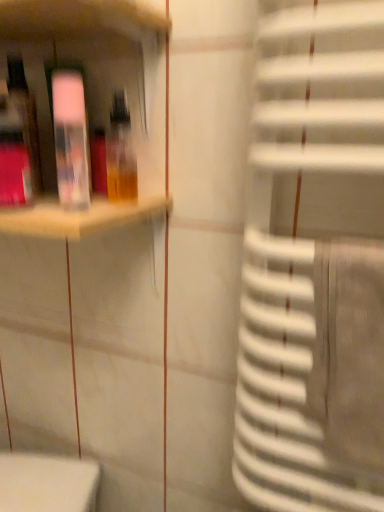
What is the approximate width of matte plastic shelf at upper left?

It is 9.54 inches.

Describe the element at coordinates (84, 58) in the screenshot. I see `matte plastic shelf at upper left` at that location.

Locate an element on the screen. The width and height of the screenshot is (384, 512). transparent plastic bottle at upper left, placed as the 1th bottle when sorted from left to right is located at coordinates (70, 136).

Identify the location of translucent plastic bottle at upper left, placed as the second bottle when sorted from left to right. This screenshot has height=512, width=384. (120, 152).

Is transparent plastic bottle at upper left, the 2th bottle in the right-to-left sequence, located outside translucent plastic bottle at upper left, the first bottle viewed from the right?

transparent plastic bottle at upper left, the 2th bottle in the right-to-left sequence, is positioned outside translucent plastic bottle at upper left, the first bottle viewed from the right.

Between point (58, 99) and point (132, 176), which one is positioned in front?

The point (58, 99) is more forward.

From a real-world perspective, which object rests below the other?

translucent plastic bottle at upper left, the first bottle viewed from the right, from a real-world perspective.

From the image's perspective, which one is positioned lower, transparent plastic bottle at upper left, the 2th bottle in the right-to-left sequence, or translucent plastic bottle at upper left, placed as the second bottle when sorted from left to right?

transparent plastic bottle at upper left, the 2th bottle in the right-to-left sequence, appears lower in the image.

Could you tell me if transparent plastic bottle at upper left, placed as the 1th bottle when sorted from left to right, is turned towards matte plastic shelf at upper left?

Yes, transparent plastic bottle at upper left, placed as the 1th bottle when sorted from left to right, is turned towards matte plastic shelf at upper left.

Considering the relative sizes of transparent plastic bottle at upper left, the 2th bottle in the right-to-left sequence, and matte plastic shelf at upper left in the image provided, is transparent plastic bottle at upper left, the 2th bottle in the right-to-left sequence, bigger than matte plastic shelf at upper left?

No.

From a real-world perspective, is transparent plastic bottle at upper left, the 2th bottle in the right-to-left sequence, under matte plastic shelf at upper left?

Incorrect, from a real-world perspective, transparent plastic bottle at upper left, the 2th bottle in the right-to-left sequence, is higher than matte plastic shelf at upper left.

Is transparent plastic bottle at upper left, placed as the 1th bottle when sorted from left to right, far away from matte plastic shelf at upper left?

No.

Considering the sizes of objects translucent plastic bottle at upper left, the first bottle viewed from the right, and matte plastic shelf at upper left in the image provided, who is shorter, translucent plastic bottle at upper left, the first bottle viewed from the right, or matte plastic shelf at upper left?

Standing shorter between the two is translucent plastic bottle at upper left, the first bottle viewed from the right.

Does point (134, 193) appear closer or farther from the camera than point (54, 238)?

Point (134, 193).

From the image's perspective, is translucent plastic bottle at upper left, the first bottle viewed from the right, positioned above or below matte plastic shelf at upper left?

Clearly, from the image's perspective, translucent plastic bottle at upper left, the first bottle viewed from the right, is below matte plastic shelf at upper left.

Can you confirm if translucent plastic bottle at upper left, the first bottle viewed from the right, is positioned to the left of matte plastic shelf at upper left?

No.

I want to click on the 2nd bottle below the matte plastic shelf at upper left (from the image's perspective), so click(70, 136).

Considering the points (133, 177) and (65, 124), which point is in front, point (133, 177) or point (65, 124)?

Positioned in front is point (65, 124).

In the image, is matte plastic shelf at upper left positioned in front of or behind transparent plastic bottle at upper left, the 2th bottle in the right-to-left sequence?

matte plastic shelf at upper left is positioned closer to the viewer than transparent plastic bottle at upper left, the 2th bottle in the right-to-left sequence.

How different are the orientations of translucent plastic bottle at upper left, the first bottle viewed from the right, and transparent plastic bottle at upper left, the 2th bottle in the right-to-left sequence, in degrees?

0.000703 degrees.

Could you measure the distance between translucent plastic bottle at upper left, placed as the second bottle when sorted from left to right, and transparent plastic bottle at upper left, the 2th bottle in the right-to-left sequence?

A distance of 7.12 centimeters exists between translucent plastic bottle at upper left, placed as the second bottle when sorted from left to right, and transparent plastic bottle at upper left, the 2th bottle in the right-to-left sequence.

Looking at their sizes, would you say translucent plastic bottle at upper left, the first bottle viewed from the right, is wider or thinner than transparent plastic bottle at upper left, the 2th bottle in the right-to-left sequence?

translucent plastic bottle at upper left, the first bottle viewed from the right, is wider than transparent plastic bottle at upper left, the 2th bottle in the right-to-left sequence.

Between translucent plastic bottle at upper left, the first bottle viewed from the right, and transparent plastic bottle at upper left, the 2th bottle in the right-to-left sequence, which one appears on the left side from the viewer's perspective?

From the viewer's perspective, transparent plastic bottle at upper left, the 2th bottle in the right-to-left sequence, appears more on the left side.

Does matte plastic shelf at upper left turn towards translucent plastic bottle at upper left, the first bottle viewed from the right?

No, matte plastic shelf at upper left does not turn towards translucent plastic bottle at upper left, the first bottle viewed from the right.

From the image's perspective, which one is positioned lower, matte plastic shelf at upper left or translucent plastic bottle at upper left, placed as the second bottle when sorted from left to right?

translucent plastic bottle at upper left, placed as the second bottle when sorted from left to right, is shown below in the image.

Which point is more forward, (43,9) or (126,122)?

The point (43,9) is closer to the camera.

In order to click on bottle on the right of the transparent plastic bottle at upper left, the 2th bottle in the right-to-left sequence in this screenshot , I will do `click(120, 152)`.

Starting from the matte plastic shelf at upper left, which bottle is the 1st one behind? Please provide its 2D coordinates.

[(70, 136)]

From the image, which object appears to be farther from matte plastic shelf at upper left, translucent plastic bottle at upper left, the first bottle viewed from the right, or transparent plastic bottle at upper left, the 2th bottle in the right-to-left sequence?

The object further to matte plastic shelf at upper left is translucent plastic bottle at upper left, the first bottle viewed from the right.

When comparing their distances from matte plastic shelf at upper left, does transparent plastic bottle at upper left, placed as the 1th bottle when sorted from left to right, or translucent plastic bottle at upper left, placed as the second bottle when sorted from left to right, seem closer?

transparent plastic bottle at upper left, placed as the 1th bottle when sorted from left to right.

From the image, which object appears to be nearer to transparent plastic bottle at upper left, placed as the 1th bottle when sorted from left to right, matte plastic shelf at upper left or translucent plastic bottle at upper left, the first bottle viewed from the right?

Based on the image, matte plastic shelf at upper left appears to be nearer to transparent plastic bottle at upper left, placed as the 1th bottle when sorted from left to right.

Which object lies nearer to the anchor point translucent plastic bottle at upper left, placed as the second bottle when sorted from left to right, transparent plastic bottle at upper left, the 2th bottle in the right-to-left sequence, or matte plastic shelf at upper left?

transparent plastic bottle at upper left, the 2th bottle in the right-to-left sequence, lies closer to translucent plastic bottle at upper left, placed as the second bottle when sorted from left to right, than the other object.

Based on their spatial positions, is translucent plastic bottle at upper left, the first bottle viewed from the right, or matte plastic shelf at upper left further from transparent plastic bottle at upper left, the 2th bottle in the right-to-left sequence?

translucent plastic bottle at upper left, the first bottle viewed from the right, is positioned further to the anchor transparent plastic bottle at upper left, the 2th bottle in the right-to-left sequence.

Based on their spatial positions, is matte plastic shelf at upper left or transparent plastic bottle at upper left, placed as the 1th bottle when sorted from left to right, further from translucent plastic bottle at upper left, the first bottle viewed from the right?

matte plastic shelf at upper left is further to translucent plastic bottle at upper left, the first bottle viewed from the right.

What are the coordinates of `bottle between matte plastic shelf at upper left and translucent plastic bottle at upper left, placed as the second bottle when sorted from left to right, along the z-axis` in the screenshot? It's located at (70, 136).